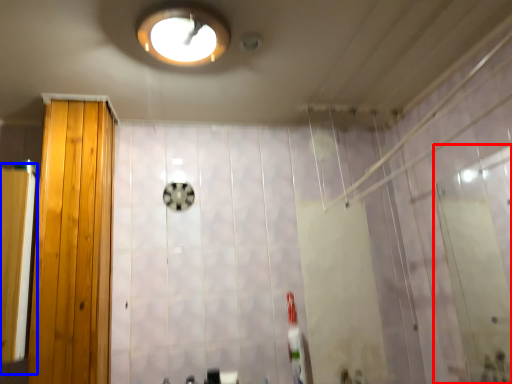
Question: Among these objects, which one is nearest to the camera, screen door (highlighted by a red box) or screen door (highlighted by a blue box)?

Choices:
 (A) screen door
 (B) screen door

Answer: (A)